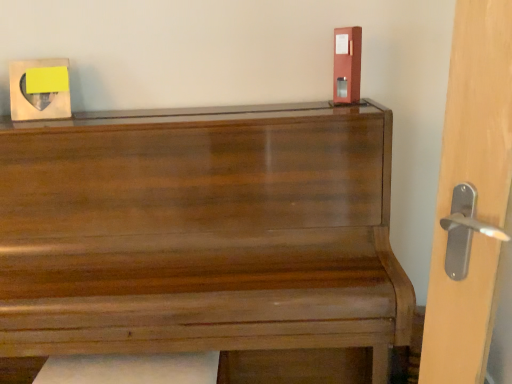
At what (x,y) coordinates should I click in order to perform the action: click on glossy wood piano at center. Please return your answer as a coordinate pair (x, y). Image resolution: width=512 pixels, height=384 pixels. Looking at the image, I should click on (206, 239).

Describe the element at coordinates (206, 239) in the screenshot. The width and height of the screenshot is (512, 384). I see `glossy wood piano at center` at that location.

What is the approximate width of glossy wood piano at center?

glossy wood piano at center is 21.85 inches wide.

Identify the location of glossy wood piano at center. (206, 239).